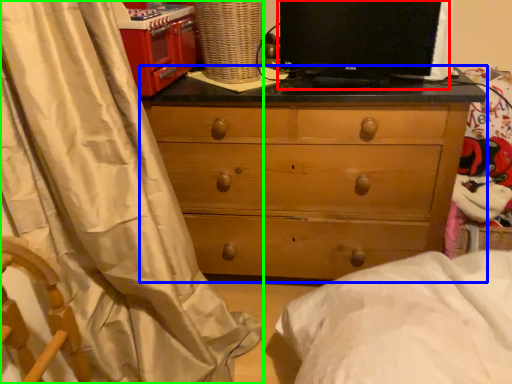
Question: Considering the real-world distances, which object is farthest from computer monitor (highlighted by a red box)? chest of drawers (highlighted by a blue box) or curtain (highlighted by a green box)?

Choices:
 (A) chest of drawers
 (B) curtain

Answer: (B)